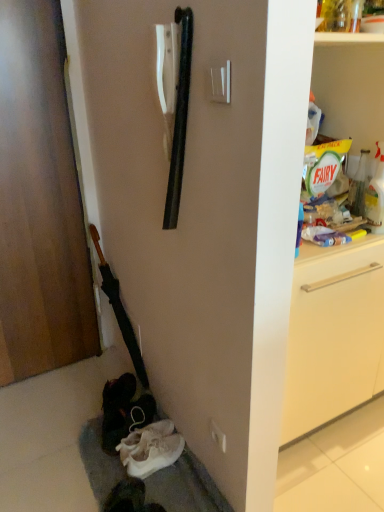
What is the approximate height of wooden door at left?

It is 5.41 feet.

What is the approximate width of wooden door at left?

wooden door at left is 3.56 inches in width.

Identify the location of white suede shoe at lower left. This screenshot has height=512, width=384. (150, 449).

Could you tell me if white plastic electric outlet at center is turned towards white suede shoe at lower left?

No, white plastic electric outlet at center does not turn towards white suede shoe at lower left.

Considering the relative sizes of white plastic electric outlet at center and white suede shoe at lower left in the image provided, is white plastic electric outlet at center thinner than white suede shoe at lower left?

Yes.

Does point (210, 425) lie behind point (162, 460)?

No, (210, 425) is in front of (162, 460).

From the image's perspective, relative to white suede shoe at lower left, is wooden door at left above or below?

From the image's perspective, wooden door at left appears above white suede shoe at lower left.

Is point (57, 100) closer to viewer compared to point (143, 430)?

No, (57, 100) is behind (143, 430).

Can you confirm if wooden door at left is wider than white suede shoe at lower left?

No.

Between white plastic electric outlet at center and white fabric shoes at lower left, which one appears on the right side from the viewer's perspective?

white plastic electric outlet at center.

Is white fabric shoes at lower left completely or partially inside white plastic electric outlet at center?

No, white fabric shoes at lower left is not surrounded by white plastic electric outlet at center.

In the image, there is a white plastic electric outlet at center. Where is `gray below it (from a real-world perspective)`? gray below it (from a real-world perspective) is located at coordinates (186, 487).

How many degrees apart are the facing directions of white plastic electric outlet at center and white fabric shoes at lower left?

0.0157 degrees.

Is wooden door at left located outside white plastic electric outlet at center?

Yes.

Considering the relative sizes of wooden door at left and white plastic electric outlet at center in the image provided, is wooden door at left bigger than white plastic electric outlet at center?

Correct, wooden door at left is larger in size than white plastic electric outlet at center.

Is wooden door at left directly adjacent to white plastic electric outlet at center?

No, wooden door at left is not in contact with white plastic electric outlet at center.

Is wooden door at left to the right of white plastic electric outlet at center from the viewer's perspective?

No, wooden door at left is not to the right of white plastic electric outlet at center.

Can you confirm if white glossy shelf at upper right is smaller than wooden door at left?

Correct, white glossy shelf at upper right occupies less space than wooden door at left.

Can you confirm if white glossy shelf at upper right is positioned to the right of wooden door at left?

Correct, you'll find white glossy shelf at upper right to the right of wooden door at left.

Does white glossy shelf at upper right turn towards wooden door at left?

No, white glossy shelf at upper right is not turned towards wooden door at left.

Is the position of white glossy shelf at upper right less distant than that of wooden door at left?

That is True.

Which is in front, point (130, 469) or point (217, 436)?

Positioned in front is point (217, 436).

Relative to white plastic electric outlet at center, is white suede shoe at lower left in front or behind?

Clearly, white suede shoe at lower left is behind white plastic electric outlet at center.

Does white suede shoe at lower left appear on the right side of white plastic electric outlet at center?

In fact, white suede shoe at lower left is to the left of white plastic electric outlet at center.

From the picture: Is white suede shoe at lower left positioned beyond the bounds of white plastic electric outlet at center?

Yes, white suede shoe at lower left is located beyond the bounds of white plastic electric outlet at center.

Can you confirm if white suede shoe at lower left is bigger than white glossy shelf at upper right?

No, white suede shoe at lower left is not bigger than white glossy shelf at upper right.

Is white suede shoe at lower left situated inside white glossy shelf at upper right or outside?

white suede shoe at lower left is not enclosed by white glossy shelf at upper right.

Is the depth of white suede shoe at lower left less than that of white glossy shelf at upper right?

No, it is not.

In the scene shown: Is white suede shoe at lower left positioned far away from white glossy shelf at upper right?

They are positioned close to each other.

This screenshot has width=384, height=512. I want to click on shoe that appears below the white plastic electric outlet at center (from the image's perspective), so (150, 449).

The width and height of the screenshot is (384, 512). Find the location of `shoe on the right of wooden door at left`. shoe on the right of wooden door at left is located at coordinates (150, 449).

From the image, which object appears to be farther from white glossy shelf at upper right, wooden door at left or white suede shoe at lower left?

wooden door at left is positioned further to the anchor white glossy shelf at upper right.

Estimate the real-world distances between objects in this image. Which object is closer to white fabric shoes at lower left, white suede shoe at lower left or wooden door at left?

white suede shoe at lower left.

When comparing their distances from wooden door at left, does white fabric shoes at lower left or white glossy shelf at upper right seem further?

white glossy shelf at upper right is further to wooden door at left.

Considering their positions, is wooden door at left positioned closer to white suede shoe at lower left than white glossy shelf at upper right?

Based on the image, white glossy shelf at upper right appears to be nearer to white suede shoe at lower left.

Looking at the image, which one is located further to white fabric shoes at lower left, white glossy shelf at upper right or wooden door at left?

wooden door at left is further to white fabric shoes at lower left.

Which object lies nearer to the anchor point white glossy shelf at upper right, white fabric shoes at lower left or white suede shoe at lower left?

white fabric shoes at lower left.

Which object lies nearer to the anchor point white plastic electric outlet at center, wooden door at left or white suede shoe at lower left?

The object closer to white plastic electric outlet at center is white suede shoe at lower left.

When comparing their distances from white glossy shelf at upper right, does white plastic electric outlet at center or white suede shoe at lower left seem closer?

The object closer to white glossy shelf at upper right is white plastic electric outlet at center.

Where is `electric outlet between white glossy shelf at upper right and white suede shoe at lower left in the front-back direction`? The width and height of the screenshot is (384, 512). electric outlet between white glossy shelf at upper right and white suede shoe at lower left in the front-back direction is located at coordinates (218, 436).

Where is `electric outlet that lies between wooden door at left and white fabric shoes at lower left from top to bottom`? electric outlet that lies between wooden door at left and white fabric shoes at lower left from top to bottom is located at coordinates (218, 436).

Locate an element on the screen. The width and height of the screenshot is (384, 512). electric outlet between wooden door at left and white suede shoe at lower left in the vertical direction is located at coordinates (218, 436).

This screenshot has height=512, width=384. What are the coordinates of `shoe between wooden door at left and white glossy shelf at upper right` in the screenshot? It's located at (150, 449).